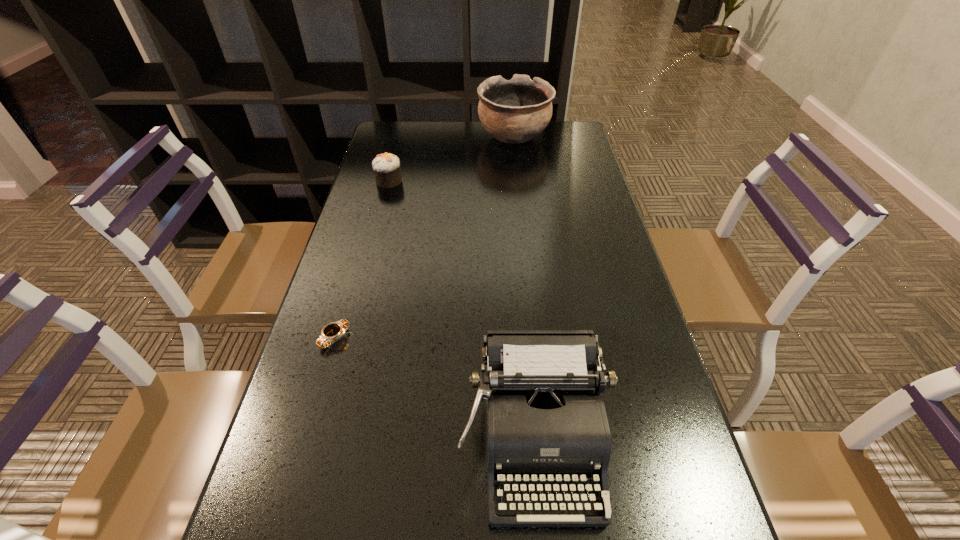
In the image, there is a desktop. Where is `vacant space at the far right corner`? This screenshot has height=540, width=960. vacant space at the far right corner is located at coordinates (560, 128).

The width and height of the screenshot is (960, 540). Find the location of `free spot between the third farthest object and the typewriter`. free spot between the third farthest object and the typewriter is located at coordinates (435, 389).

Find the location of a particular element. free area in between the cupcake and the farthest object is located at coordinates (451, 159).

Identify the location of vacant space in between the farthest object and the shortest object. (424, 238).

The image size is (960, 540). In order to click on free space between the second farthest object and the second nearest object in this screenshot , I will do coord(362,259).

You are a GUI agent. You are given a task and a screenshot of the screen. Output one action in this format:
    pyautogui.click(x=<x>, y=<y>)
    Task: Click on the vacant space in between the watch and the nearest object
    This screenshot has width=960, height=540.
    Given the screenshot: What is the action you would take?
    pyautogui.click(x=435, y=389)

Where is `free spot between the tallest object and the cupcake`? This screenshot has height=540, width=960. free spot between the tallest object and the cupcake is located at coordinates (451, 159).

The image size is (960, 540). In order to click on free point between the shortest object and the tallest object in this screenshot , I will do `click(424, 238)`.

Locate an element on the screen. This screenshot has width=960, height=540. free space between the pottery and the shortest object is located at coordinates pos(424,238).

Find the location of `vacant space that's between the typewriter and the watch`. vacant space that's between the typewriter and the watch is located at coordinates (435, 389).